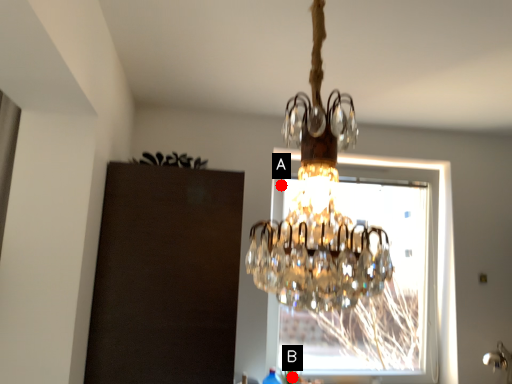
Question: Two points are circled on the image, labeled by A and B beside each circle. Which point is closer to the camera?

Choices:
 (A) A is closer
 (B) B is closer

Answer: (B)